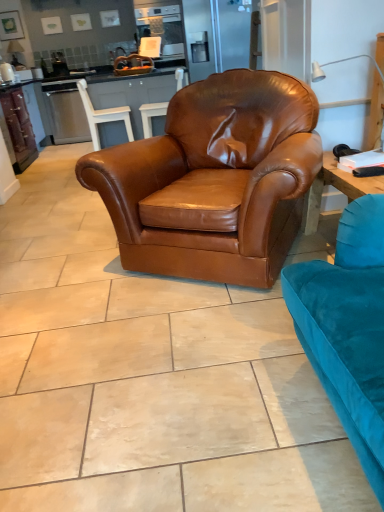
Question: Is brown leather armchair at center, which is counted as the 3th chair, starting from the front, to the left or to the right of brown leather armchair at center, which is the 2th chair in back-to-front order, in the image?

Choices:
 (A) left
 (B) right

Answer: (B)

Question: Considering the positions of brown leather armchair at center, which is counted as the 1th chair, starting from the back, and brown leather armchair at center, which is the 2th chair in back-to-front order, in the image, is brown leather armchair at center, which is counted as the 1th chair, starting from the back, wider or thinner than brown leather armchair at center, which is the 2th chair in back-to-front order,?

Choices:
 (A) thin
 (B) wide

Answer: (B)

Question: Considering the real-world distances, which object is farthest from the brown leather armchair at center, which is counted as the 1th chair, starting from the back?

Choices:
 (A) satin silver oven at upper center
 (B) brown leather armchair at center, which is the 2th chair in back-to-front order
 (C) brown leather armchair at center, which is counted as the third chair, starting from the back

Answer: (C)

Question: Which object is the closest to the brown leather armchair at center, which ranks as the 1th chair in front-to-back order?

Choices:
 (A) satin silver oven at upper center
 (B) brown leather armchair at center, which is counted as the 3th chair, starting from the front
 (C) brown leather armchair at center, the 2th chair viewed from the front

Answer: (B)